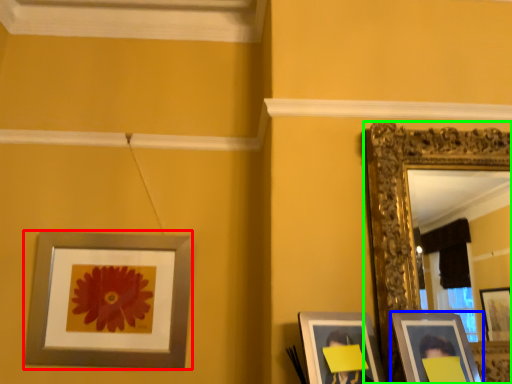
Question: Which object is positioned closest to picture frame (highlighted by a red box)? Select from picture frame (highlighted by a blue box) and picture frame (highlighted by a green box).

Choices:
 (A) picture frame
 (B) picture frame

Answer: (B)